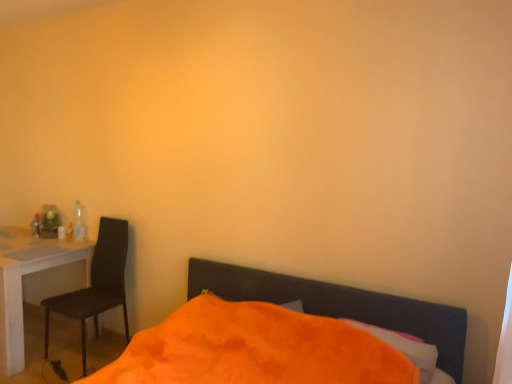
Question: From a real-world perspective, is orange soft pillow at lower center physically located above or below white glossy desk at left?

Choices:
 (A) above
 (B) below

Answer: (A)

Question: Would you say orange soft pillow at lower center is to the left or to the right of white glossy desk at left in the picture?

Choices:
 (A) left
 (B) right

Answer: (B)

Question: Which object is the farthest from the translucent plastic bottle at left?

Choices:
 (A) orange fuzzy bed at lower center
 (B) white glossy desk at left
 (C) orange soft pillow at lower center
 (D) black matte chair at left

Answer: (C)

Question: Considering the real-world distances, which object is closest to the translucent plastic bottle at left?

Choices:
 (A) black matte chair at left
 (B) orange fuzzy bed at lower center
 (C) orange soft pillow at lower center
 (D) white glossy desk at left

Answer: (D)